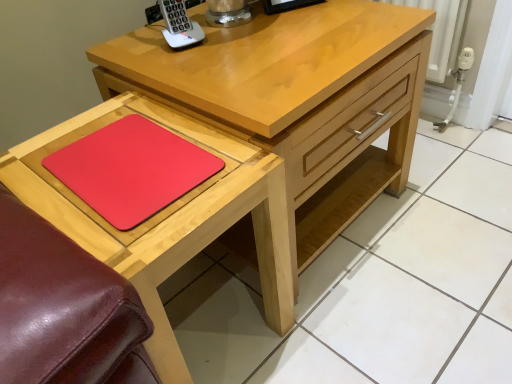
Find the location of a particular element. The height and width of the screenshot is (384, 512). empty space that is ontop of matte wooden table at lower left (from a real-world perspective) is located at coordinates (121, 161).